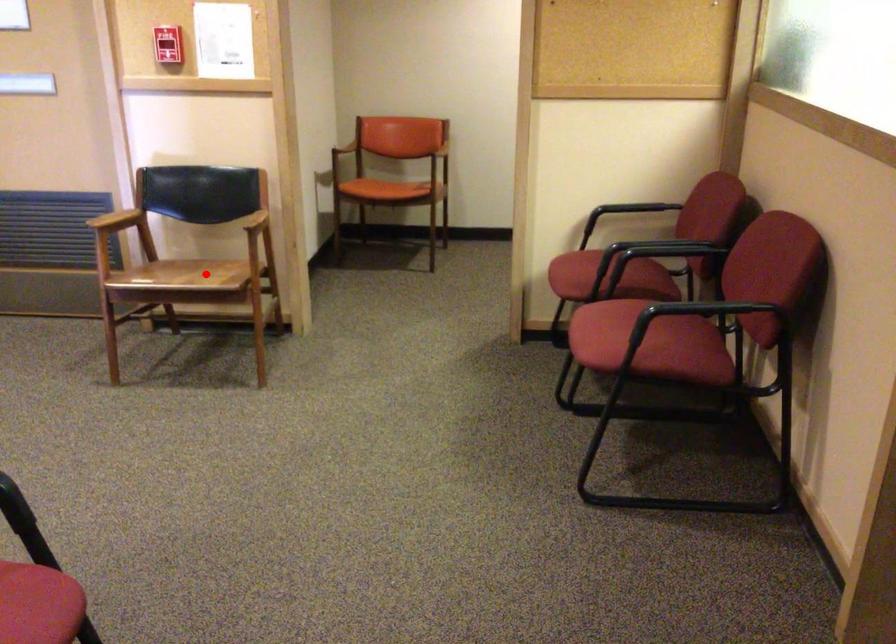
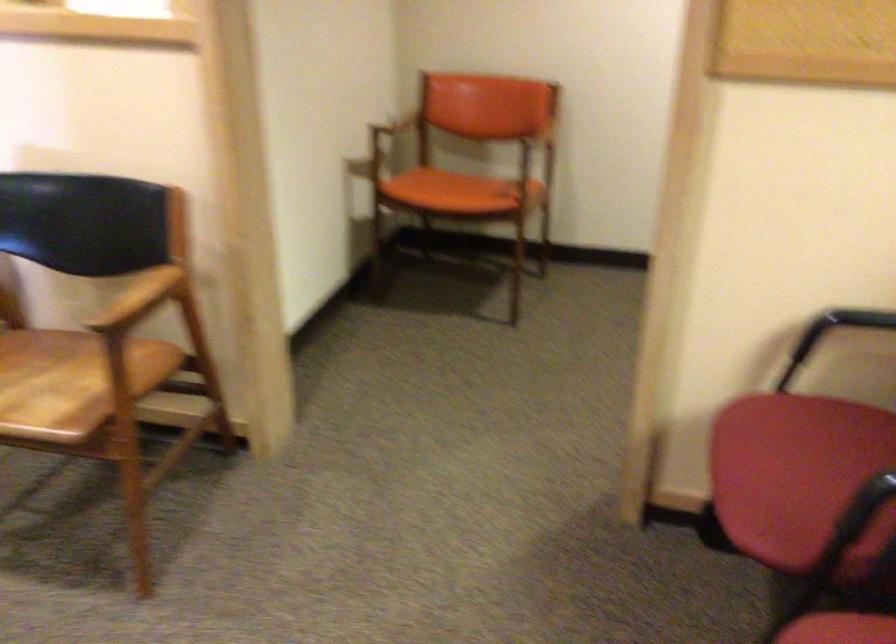
Question: I am providing you with two images of the same scene from different viewpoints. A red point is marked on the first image. Is the red point's position out of view in image 2?

Choices:
 (A) Yes
 (B) No

Answer: (B)